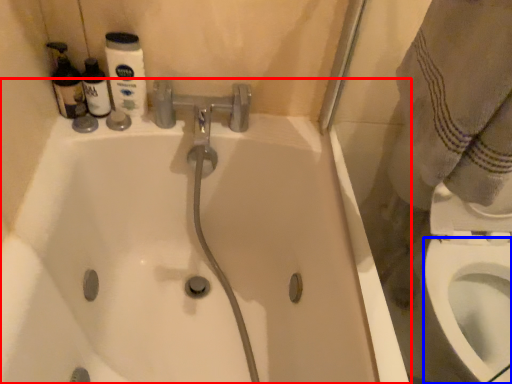
Question: Which object is further to the camera taking this photo, bathtub (highlighted by a red box) or bidet (highlighted by a blue box)?

Choices:
 (A) bathtub
 (B) bidet

Answer: (B)